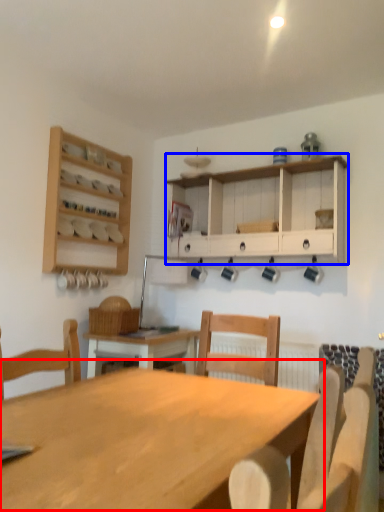
Question: Which object appears farthest to the camera in this image, table (highlighted by a red box) or cabinetry (highlighted by a blue box)?

Choices:
 (A) table
 (B) cabinetry

Answer: (B)